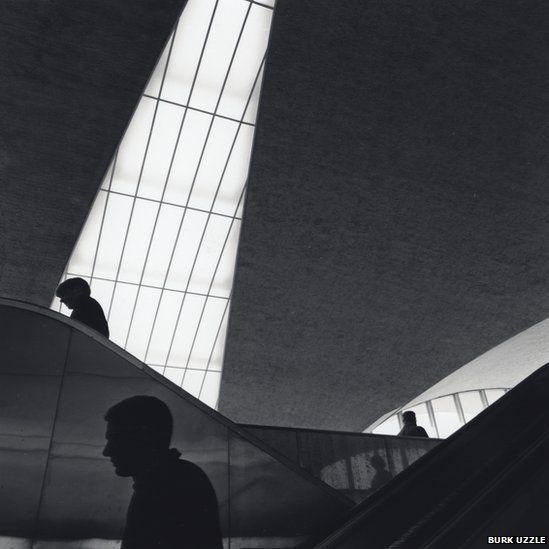
The image size is (549, 549). What are the coordinates of `skylight panel` in the screenshot? It's located at (162, 243).